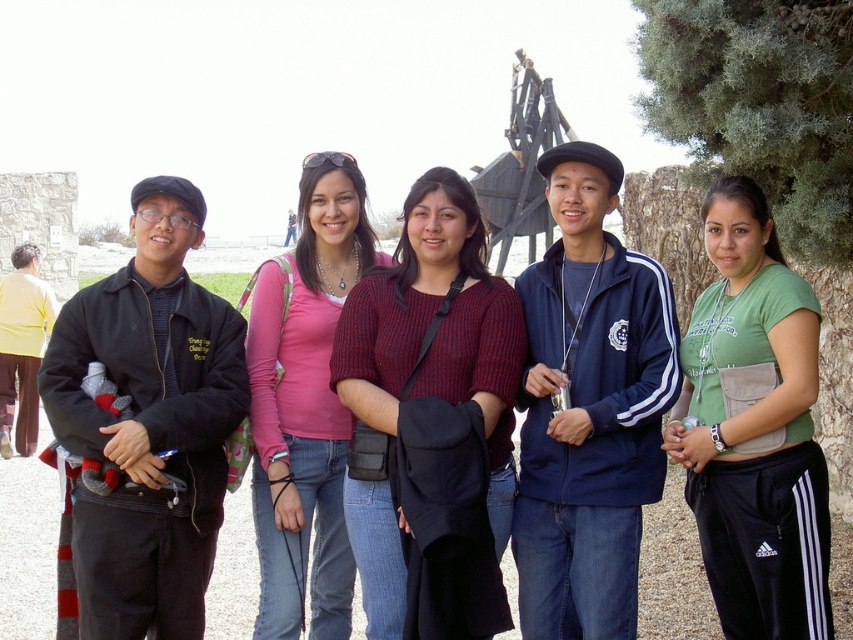
You are standing in front of the historical site and want to locate the black matte jacket at left. According to the coordinates provided, where exactly should you look?

The black matte jacket at left is located at the coordinates point (149, 422).

You are standing in front of the historical site and want to take a photo. You notice two points marked at coordinates point (190,508) and point (614,186). Which point is closer to you?

Point (190,508) is closer to the viewer than point (614,186).